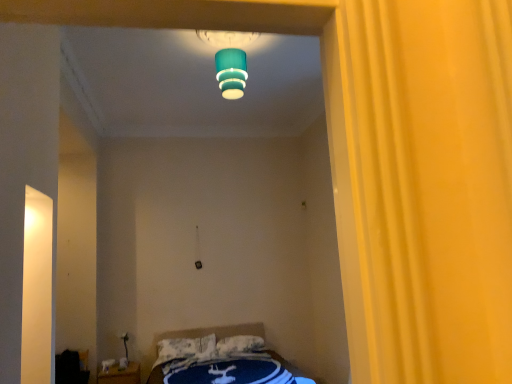
Question: Should I look upward or downward to see blue fabric bed at lower center?

Choices:
 (A) up
 (B) down

Answer: (B)

Question: From the image's perspective, would you say teal matte lampshade at upper center is shown under wooden nightstand at lower left?

Choices:
 (A) yes
 (B) no

Answer: (B)

Question: From the image's perspective, is teal matte lampshade at upper center located above wooden nightstand at lower left?

Choices:
 (A) yes
 (B) no

Answer: (A)

Question: Does teal matte lampshade at upper center have a lesser width compared to wooden nightstand at lower left?

Choices:
 (A) yes
 (B) no

Answer: (B)

Question: Is teal matte lampshade at upper center at the left side of wooden nightstand at lower left?

Choices:
 (A) yes
 (B) no

Answer: (B)

Question: Is teal matte lampshade at upper center shorter than wooden nightstand at lower left?

Choices:
 (A) no
 (B) yes

Answer: (A)

Question: Is teal matte lampshade at upper center far away from wooden nightstand at lower left?

Choices:
 (A) yes
 (B) no

Answer: (A)

Question: Is white textured pillow at center, which is the second pillow in right-to-left order, a part of black fabric bag at lower left?

Choices:
 (A) yes
 (B) no

Answer: (B)

Question: Is black fabric bag at lower left to the left of white textured pillow at center, the 1th pillow positioned from the left, from the viewer's perspective?

Choices:
 (A) yes
 (B) no

Answer: (A)

Question: From the image's perspective, would you say black fabric bag at lower left is shown under white textured pillow at center, which is the second pillow in right-to-left order?

Choices:
 (A) yes
 (B) no

Answer: (A)

Question: From a real-world perspective, is black fabric bag at lower left under white textured pillow at center, the 1th pillow positioned from the left?

Choices:
 (A) no
 (B) yes

Answer: (B)

Question: From a real-world perspective, is black fabric bag at lower left positioned over white textured pillow at center, the 1th pillow positioned from the left, based on gravity?

Choices:
 (A) no
 (B) yes

Answer: (A)

Question: From the image's perspective, is black fabric bag at lower left located above white textured pillow at center, the 1th pillow positioned from the left?

Choices:
 (A) no
 (B) yes

Answer: (A)

Question: From the image's perspective, does white soft pillow at lower center, the 2th pillow when ordered from left to right, appear higher than teal matte lampshade at upper center?

Choices:
 (A) no
 (B) yes

Answer: (A)